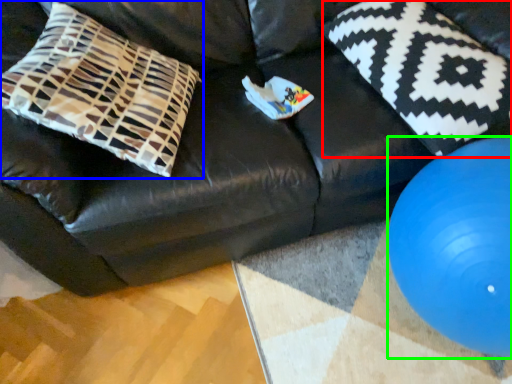
Question: Based on their relative distances, which object is farther from pillow (highlighted by a red box)? Choose from pillow (highlighted by a blue box) and ball (highlighted by a green box).

Choices:
 (A) pillow
 (B) ball

Answer: (A)